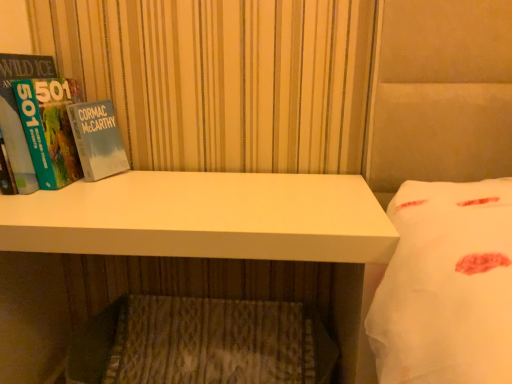
Question: Is point (25, 82) closer or farther from the camera than point (161, 319)?

Choices:
 (A) closer
 (B) farther

Answer: (A)

Question: Considering their positions, is hardcover book at left located in front of or behind wooden textured mattress at lower center?

Choices:
 (A) behind
 (B) front

Answer: (B)

Question: Estimate the real-world distances between objects in this image. Which object is closer to the hardcover book at left?

Choices:
 (A) white matte desk at center
 (B) wooden textured mattress at lower center

Answer: (A)

Question: Which of these objects is positioned closest to the wooden textured mattress at lower center?

Choices:
 (A) hardcover book at left
 (B) white matte desk at center

Answer: (B)